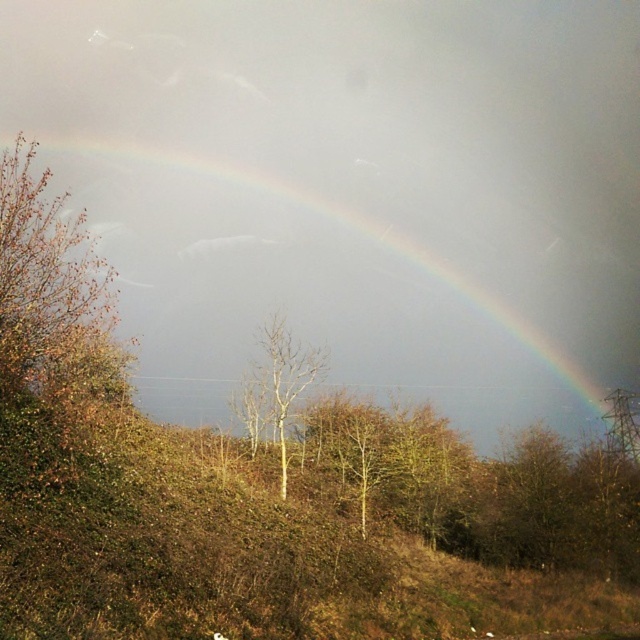
Question: Can you confirm if rainbow at upper center is positioned below bare wood tree at center?

Choices:
 (A) no
 (B) yes

Answer: (A)

Question: Which of the following is the farthest from the observer?

Choices:
 (A) bare wood tree at center
 (B) rainbow at upper center

Answer: (B)

Question: Among these points, which one is farthest from the camera?

Choices:
 (A) (259, 432)
 (B) (323, 220)

Answer: (B)

Question: Does rainbow at upper center have a greater width compared to bare wood tree at center?

Choices:
 (A) no
 (B) yes

Answer: (B)

Question: Can you confirm if rainbow at upper center is smaller than bare wood tree at center?

Choices:
 (A) no
 (B) yes

Answer: (A)